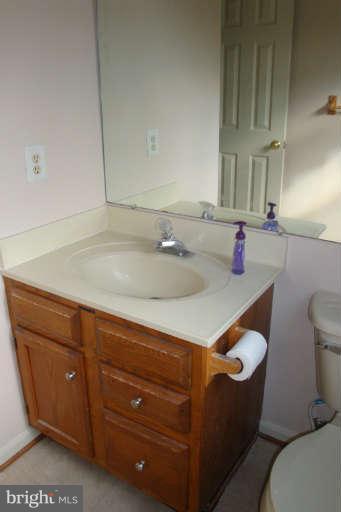
Image resolution: width=341 pixels, height=512 pixels. In order to click on toilet paper in this screenshot , I will do `click(249, 352)`.